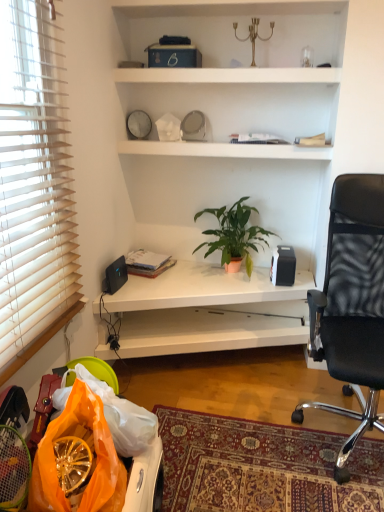
Where is `vacant area that is in front of black plastic speaker at lower left, the 1th loudspeaker when ordered from left to right`? This screenshot has width=384, height=512. vacant area that is in front of black plastic speaker at lower left, the 1th loudspeaker when ordered from left to right is located at coordinates tap(115, 294).